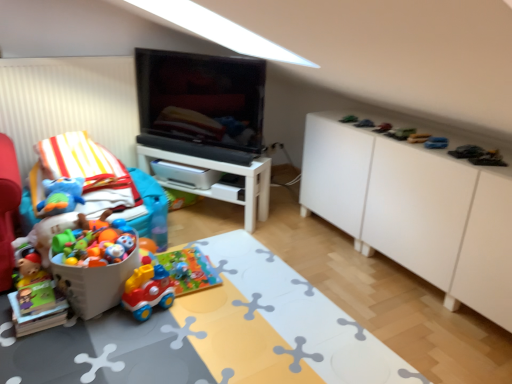
The width and height of the screenshot is (512, 384). I want to click on vacant space situated on the left part of blue rubber toy at upper right, which is the third toy from right to left, so click(411, 142).